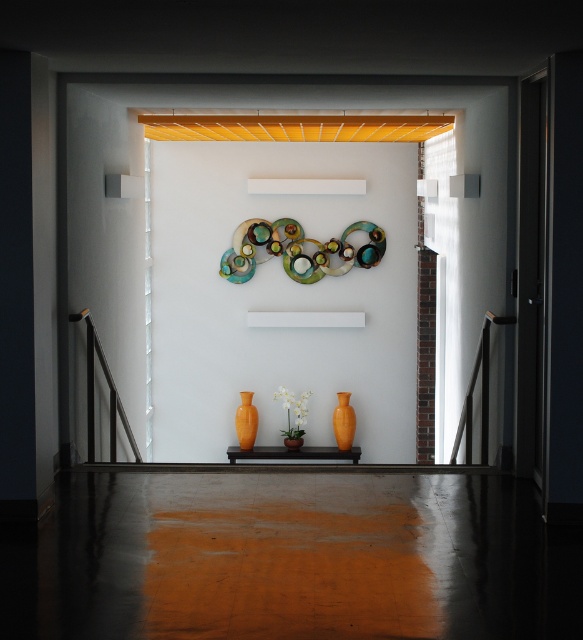
You are a delivery person carrying a large package that requires placing it exactly between the orange glossy vase at center and the orange matte vase at center. Given that the distance between them is 5.42 feet, can you position the package so that it is equidistant from both vases?

The orange glossy vase at center is 5.42 feet from the orange matte vase at center. To place the package equidistant between them, you would position it 2.71 feet from each vase, which is feasible as the distance allows for such placement.

You are an interior designer planning to place a new shelf in the hallway. You have two options for placement either next to the orange glossy vase at center or next to the translucent glass vase at center. Which vase should you choose if you want the shelf to be placed closer to the narrower object?

The orange glossy vase at center is thinner than the translucent glass vase at center, so you should place the shelf next to the orange glossy vase at center since it is narrower.